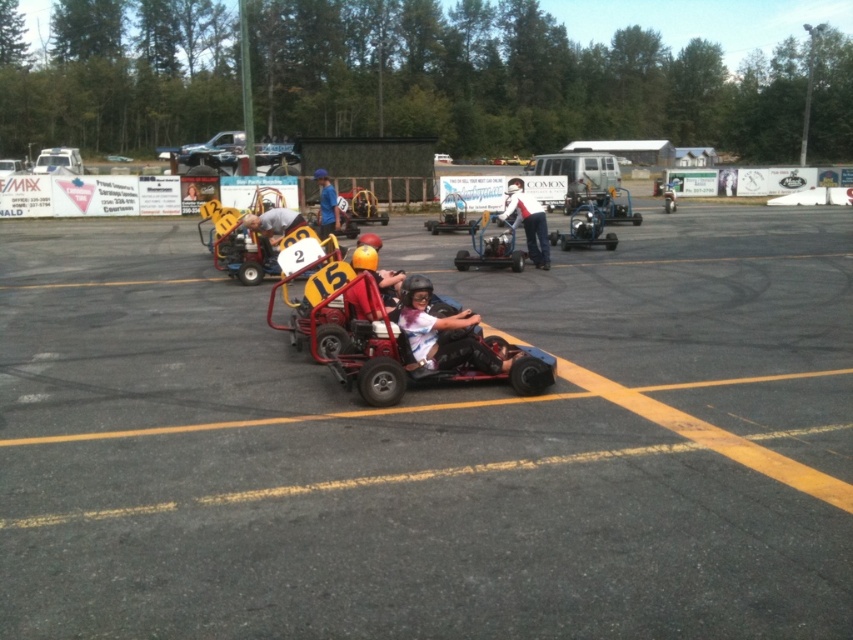
Question: Does matte red helmet at center appear on the right side of metallic silver go-kart at center?

Choices:
 (A) no
 (B) yes

Answer: (A)

Question: Which object appears farthest from the camera in this image?

Choices:
 (A) metallic yellow helmet at center
 (B) metallic silver go-kart at center

Answer: (B)

Question: Does metallic red go-kart at center have a lesser width compared to metallic blue go-kart at center?

Choices:
 (A) no
 (B) yes

Answer: (A)

Question: Is black rubber race track at center to the left of metallic silver van at center from the viewer's perspective?

Choices:
 (A) yes
 (B) no

Answer: (A)

Question: Among these objects, which one is farthest from the camera?

Choices:
 (A) blue fabric shirt at center
 (B) metallic silver go-kart at center
 (C) white plastic car at upper left
 (D) metallic yellow helmet at center

Answer: (C)

Question: Which of the following is the farthest from the observer?

Choices:
 (A) metallic red go-kart at center
 (B) black rubber race track at center
 (C) metallic blue go-kart at center

Answer: (C)